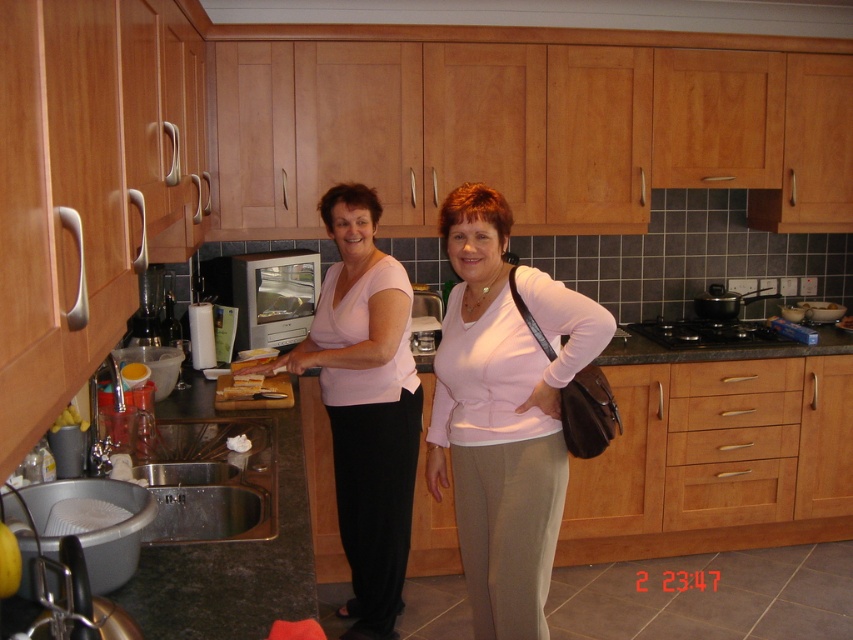
Is light brown wood drawer at lower center wider than wooden drawer at center?

Yes, light brown wood drawer at lower center is wider than wooden drawer at center.

Can you confirm if light brown wood drawer at lower center is positioned to the left of wooden drawer at center?

Yes, light brown wood drawer at lower center is to the left of wooden drawer at center.

The height and width of the screenshot is (640, 853). What do you see at coordinates (730, 442) in the screenshot?
I see `light brown wood drawer at lower center` at bounding box center [730, 442].

The height and width of the screenshot is (640, 853). In order to click on light brown wood drawer at lower center in this screenshot , I will do `click(730, 442)`.

Is pink matte sweater at center smaller than wooden drawer at center?

Incorrect, pink matte sweater at center is not smaller in size than wooden drawer at center.

Identify the location of pink matte sweater at center. (503, 412).

Who is more forward, (434, 385) or (718, 387)?

Positioned in front is point (434, 385).

The height and width of the screenshot is (640, 853). Identify the location of pink matte sweater at center. (503, 412).

Does granite countertop at center appear on the right side of stainless steel sink at lower left?

Yes, granite countertop at center is to the right of stainless steel sink at lower left.

Is granite countertop at center to the left of stainless steel sink at lower left from the viewer's perspective?

Incorrect, granite countertop at center is not on the left side of stainless steel sink at lower left.

The width and height of the screenshot is (853, 640). Find the location of `granite countertop at center`. granite countertop at center is located at coordinates tap(688, 467).

Find the location of a particular element. granite countertop at center is located at coordinates (688, 467).